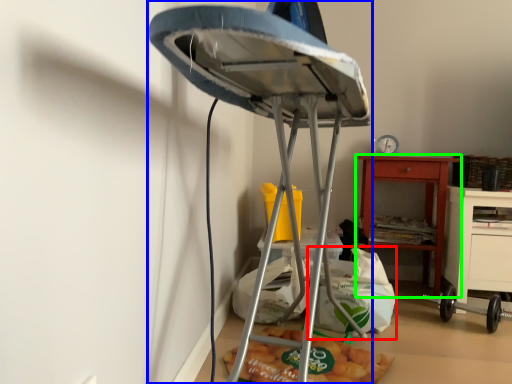
Question: Which object is positioned farthest from shopping bag (highlighted by a red box)? Select from furniture (highlighted by a blue box) and nightstand (highlighted by a green box).

Choices:
 (A) furniture
 (B) nightstand

Answer: (A)